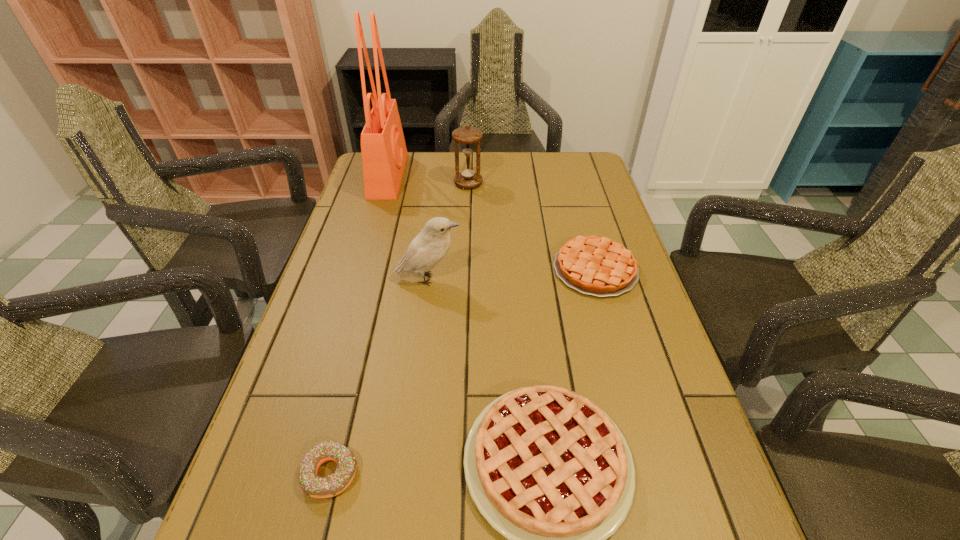
Where is `tote bag situated at the far edge`? The height and width of the screenshot is (540, 960). tote bag situated at the far edge is located at coordinates (384, 154).

The height and width of the screenshot is (540, 960). I want to click on hourglass that is positioned at the far edge, so click(469, 177).

Find the location of `tote bag present at the left edge`. tote bag present at the left edge is located at coordinates (384, 154).

At what (x,y) coordinates should I click in order to perform the action: click on doughnut located at the left edge. Please return your answer as a coordinate pair (x, y). This screenshot has width=960, height=540. Looking at the image, I should click on (313, 485).

The width and height of the screenshot is (960, 540). I want to click on object that is at the right edge, so pos(598,266).

Identify the location of object present at the far left corner. coord(384,154).

At what (x,y) coordinates should I click in order to perform the action: click on vacant area at the far edge of the desktop. Please return your answer as a coordinate pair (x, y). Looking at the image, I should click on click(449, 163).

Find the location of a particular element. The image size is (960, 540). vacant space at the left edge of the desktop is located at coordinates (349, 242).

In the image, there is a desktop. At what (x,y) coordinates should I click in order to perform the action: click on vacant space at the right edge. Please return your answer as a coordinate pair (x, y). Image resolution: width=960 pixels, height=540 pixels. Looking at the image, I should click on (622, 356).

This screenshot has height=540, width=960. Find the location of `free space at the far left corner`. free space at the far left corner is located at coordinates (359, 180).